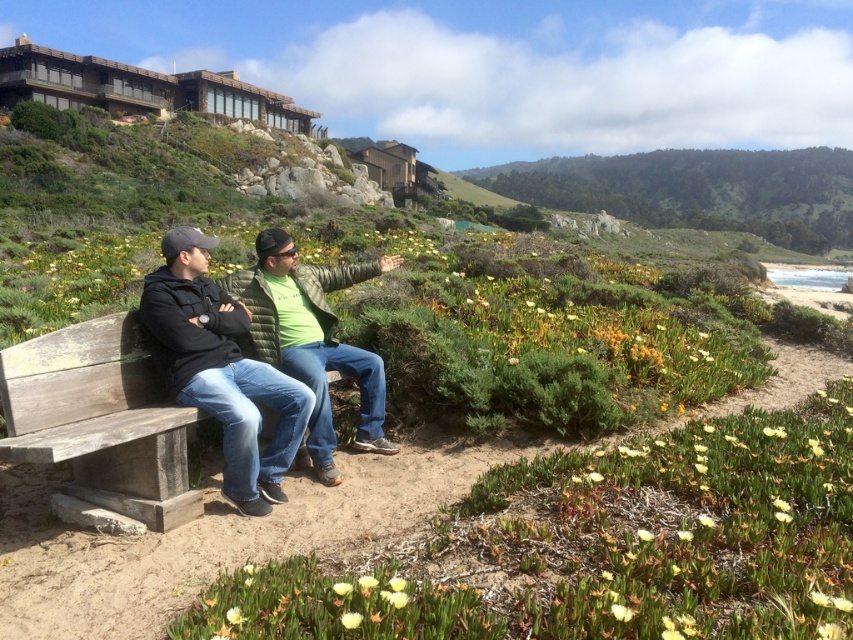
Question: Is weathered wood bench at lower left behind matte black jacket at center?

Choices:
 (A) no
 (B) yes

Answer: (A)

Question: Which point is closer to the camera taking this photo?

Choices:
 (A) (222, 316)
 (B) (178, 432)

Answer: (B)

Question: Is weathered wood bench at lower left positioned at the back of matte black jacket at center?

Choices:
 (A) yes
 (B) no

Answer: (B)

Question: Is weathered wood bench at lower left to the left of matte black jacket at center from the viewer's perspective?

Choices:
 (A) no
 (B) yes

Answer: (B)

Question: Which object is farther from the camera taking this photo?

Choices:
 (A) matte black jacket at center
 (B) weathered wood bench at lower left

Answer: (A)

Question: Which object is closer to the camera taking this photo?

Choices:
 (A) matte black jacket at center
 (B) weathered wood bench at lower left

Answer: (B)